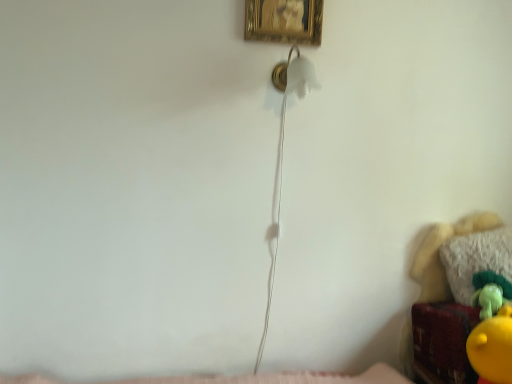
Describe the element at coordinates (439, 256) in the screenshot. Image resolution: width=512 pixels, height=384 pixels. I see `velvet plush toy at lower right` at that location.

The width and height of the screenshot is (512, 384). In order to click on white fluffy pillow at lower right in this screenshot , I will do (476, 259).

In order to face gold textured picture frame at upper center, should I rotate leftwards or rightwards?

A 4.059 degree turn to the right will do.

The height and width of the screenshot is (384, 512). I want to click on velvet plush toy at lower right, so click(439, 256).

Considering the relative sizes of white fluffy pillow at lower right and gold textured picture frame at upper center in the image provided, is white fluffy pillow at lower right bigger than gold textured picture frame at upper center?

Indeed, white fluffy pillow at lower right has a larger size compared to gold textured picture frame at upper center.

Is white fluffy pillow at lower right surrounding gold textured picture frame at upper center?

No, gold textured picture frame at upper center is not a part of white fluffy pillow at lower right.

Where is `pillow below the gold textured picture frame at upper center (from a real-world perspective)`? This screenshot has height=384, width=512. pillow below the gold textured picture frame at upper center (from a real-world perspective) is located at coordinates (476, 259).

Which object is positioned more to the left, velvet plush toy at lower right or white fluffy pillow at lower right?

From the viewer's perspective, velvet plush toy at lower right appears more on the left side.

From the picture: Is velvet plush toy at lower right oriented away from white fluffy pillow at lower right?

Yes, white fluffy pillow at lower right is at the back of velvet plush toy at lower right.

Considering the sizes of objects velvet plush toy at lower right and white fluffy pillow at lower right in the image provided, who is taller, velvet plush toy at lower right or white fluffy pillow at lower right?

With more height is velvet plush toy at lower right.

Is velvet plush toy at lower right smaller than white fluffy pillow at lower right?

No, velvet plush toy at lower right is not smaller than white fluffy pillow at lower right.

From a real-world perspective, between gold textured picture frame at upper center and velvet plush toy at lower right, who is vertically lower?

In real-world perspective, velvet plush toy at lower right is lower.

Looking at this image, based on their positions, is gold textured picture frame at upper center located to the left or right of velvet plush toy at lower right?

Based on their positions, gold textured picture frame at upper center is located to the left of velvet plush toy at lower right.

In the scene shown: Considering the sizes of gold textured picture frame at upper center and velvet plush toy at lower right in the image, is gold textured picture frame at upper center wider or thinner than velvet plush toy at lower right?

Considering their sizes, gold textured picture frame at upper center looks slimmer than velvet plush toy at lower right.

Does gold textured picture frame at upper center have a larger size compared to velvet plush toy at lower right?

No.

From a real-world perspective, is velvet plush toy at lower right on gold textured picture frame at upper center?

No, from a real-world perspective, velvet plush toy at lower right is not over gold textured picture frame at upper center

Which of these two, velvet plush toy at lower right or gold textured picture frame at upper center, is bigger?

velvet plush toy at lower right.

From the image's perspective, does velvet plush toy at lower right appear higher than gold textured picture frame at upper center?

No, from the image's perspective, velvet plush toy at lower right is not above gold textured picture frame at upper center.

Who is bigger, gold textured picture frame at upper center or white fluffy pillow at lower right?

white fluffy pillow at lower right is bigger.

Which object is positioned more to the right, gold textured picture frame at upper center or white fluffy pillow at lower right?

white fluffy pillow at lower right is more to the right.

From a real-world perspective, does white fluffy pillow at lower right stand above velvet plush toy at lower right?

Yes, from a real-world perspective, white fluffy pillow at lower right is above velvet plush toy at lower right.

From the image's perspective, between white fluffy pillow at lower right and velvet plush toy at lower right, who is located below?

velvet plush toy at lower right, from the image's perspective.

Between white fluffy pillow at lower right and velvet plush toy at lower right, which one has smaller width?

Thinner between the two is white fluffy pillow at lower right.

Is white fluffy pillow at lower right to the right of velvet plush toy at lower right from the viewer's perspective?

Indeed, white fluffy pillow at lower right is positioned on the right side of velvet plush toy at lower right.

Where is `pillow below the gold textured picture frame at upper center (from the image's perspective)`? The width and height of the screenshot is (512, 384). pillow below the gold textured picture frame at upper center (from the image's perspective) is located at coordinates (476, 259).

Where is `furniture on the left of white fluffy pillow at lower right`? This screenshot has height=384, width=512. furniture on the left of white fluffy pillow at lower right is located at coordinates (439, 256).

Considering their positions, is velvet plush toy at lower right positioned further to gold textured picture frame at upper center than white fluffy pillow at lower right?

Based on the image, white fluffy pillow at lower right appears to be further to gold textured picture frame at upper center.

From the image, which object appears to be farther from gold textured picture frame at upper center, white fluffy pillow at lower right or velvet plush toy at lower right?

white fluffy pillow at lower right.

From the image, which object appears to be farther from velvet plush toy at lower right, white fluffy pillow at lower right or gold textured picture frame at upper center?

Based on the image, gold textured picture frame at upper center appears to be further to velvet plush toy at lower right.

Looking at this image, from the image, which object appears to be nearer to velvet plush toy at lower right, gold textured picture frame at upper center or white fluffy pillow at lower right?

white fluffy pillow at lower right is closer to velvet plush toy at lower right.

Based on their spatial positions, is velvet plush toy at lower right or gold textured picture frame at upper center closer to white fluffy pillow at lower right?

velvet plush toy at lower right lies closer to white fluffy pillow at lower right than the other object.

Based on their spatial positions, is gold textured picture frame at upper center or velvet plush toy at lower right closer to white fluffy pillow at lower right?

Based on the image, velvet plush toy at lower right appears to be nearer to white fluffy pillow at lower right.

Identify the location of pillow between gold textured picture frame at upper center and velvet plush toy at lower right in the up-down direction. (476, 259).